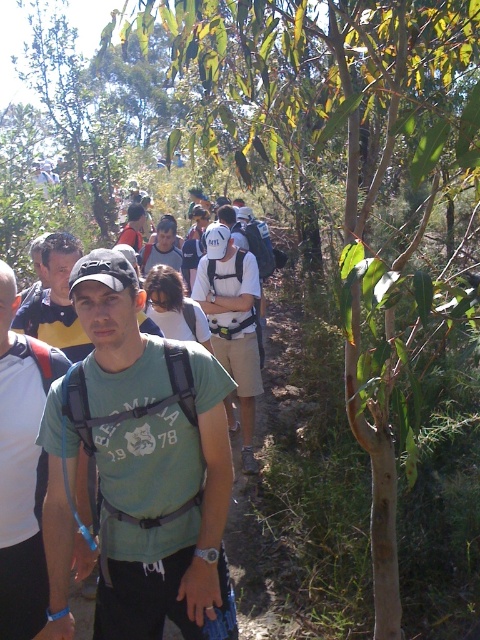
Who is more forward, (22, 531) or (244, 412)?

Point (22, 531)

Does green fabric shirt at center have a lesser height compared to white matte backpack at center?

Correct, green fabric shirt at center is not as tall as white matte backpack at center.

In the scene shown: Measure the distance between green fabric shirt at center and camera.

A distance of 7.08 feet exists between green fabric shirt at center and camera.

I want to click on green fabric shirt at center, so click(21, 468).

Can you confirm if green matte t-shirt at center is shorter than matte black backpack at center?

Incorrect, green matte t-shirt at center's height does not fall short of matte black backpack at center's.

Which of these two, green matte t-shirt at center or matte black backpack at center, stands taller?

With more height is green matte t-shirt at center.

Between point (90, 317) and point (124, 227), which one is positioned behind?

Positioned behind is point (124, 227).

Identify the location of green matte t-shirt at center. The height and width of the screenshot is (640, 480). (153, 464).

Based on the photo, which is more to the right, green matte t-shirt at center or matte gray shirt at center?

green matte t-shirt at center is more to the right.

Based on the photo, is green matte t-shirt at center above matte gray shirt at center?

No.

Is point (117, 348) less distant than point (148, 257)?

Yes.

Where is `green matte t-shirt at center`? This screenshot has width=480, height=640. green matte t-shirt at center is located at coordinates (153, 464).